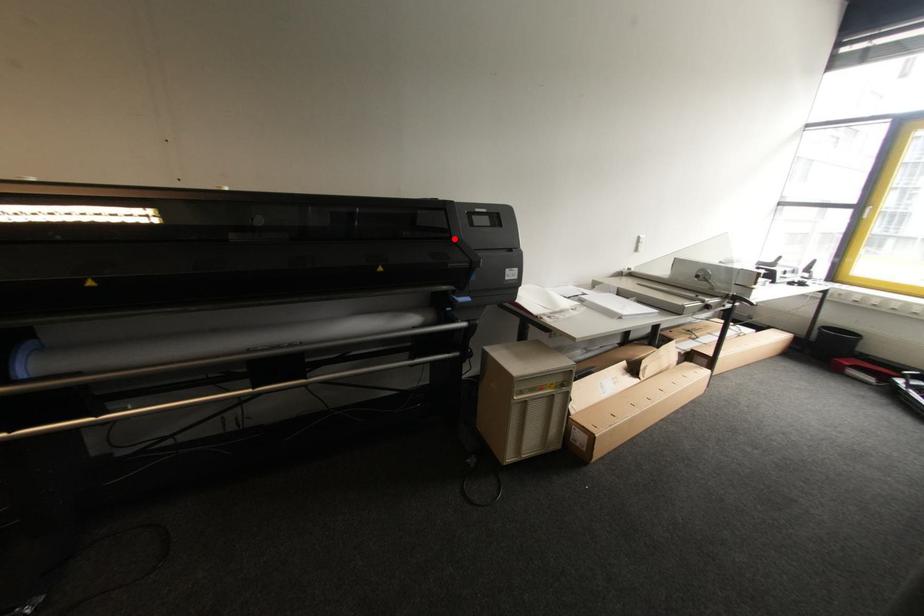
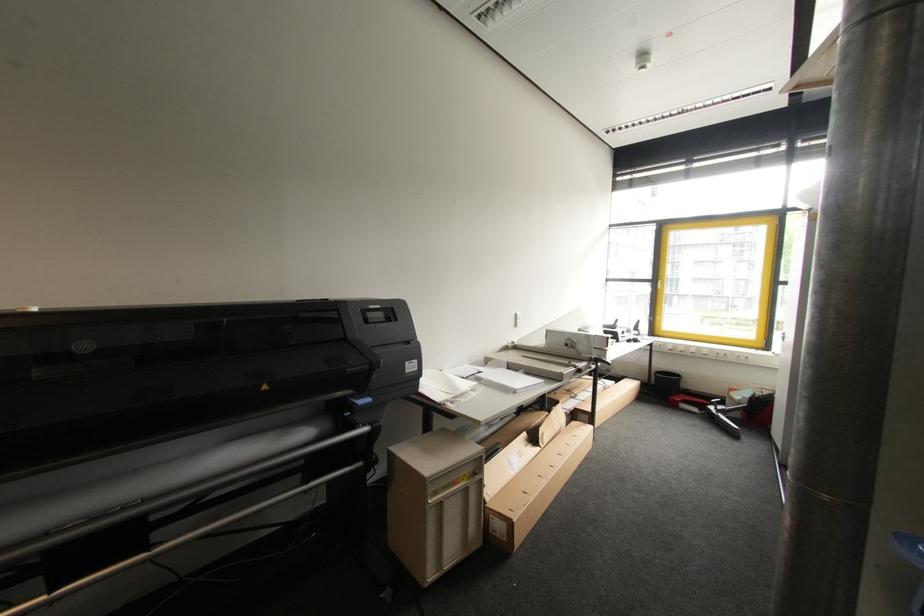
The point at the highlighted location is marked in the first image. Where is the corresponding point in the second image?

(348, 339)